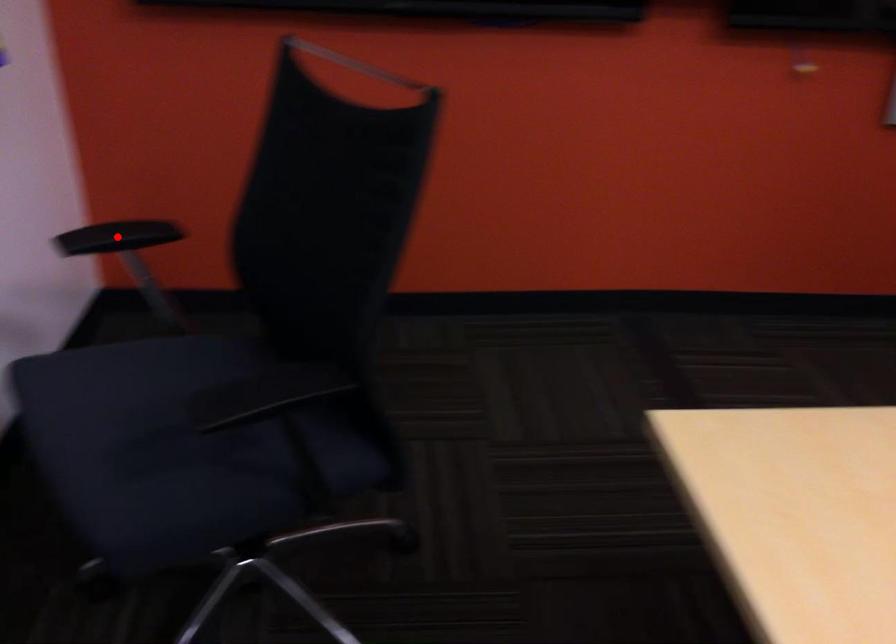
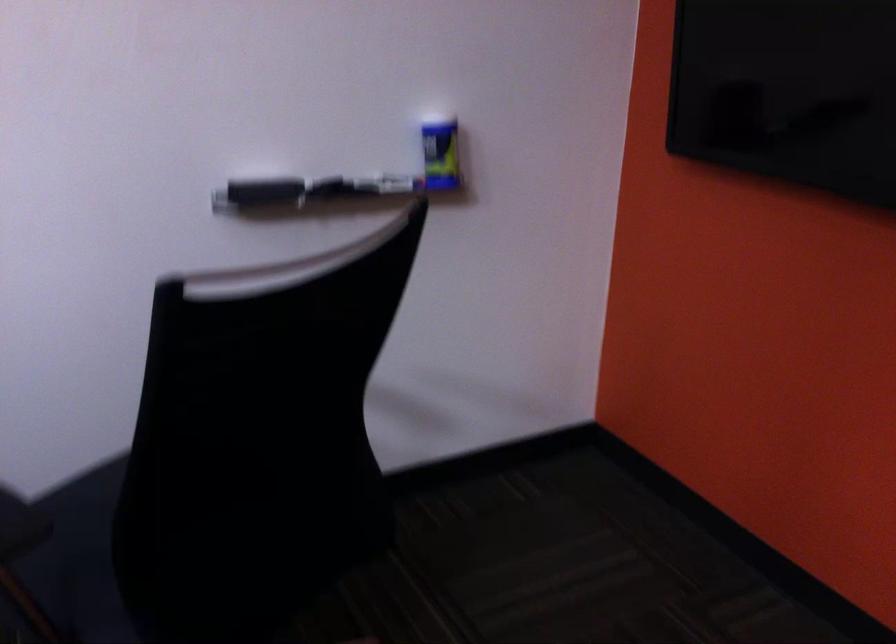
Question: I am providing you with two images of the same scene from different viewpoints. A red point is marked on the first image. Is the red point's position out of view in image 2?

Choices:
 (A) Yes
 (B) No

Answer: (A)